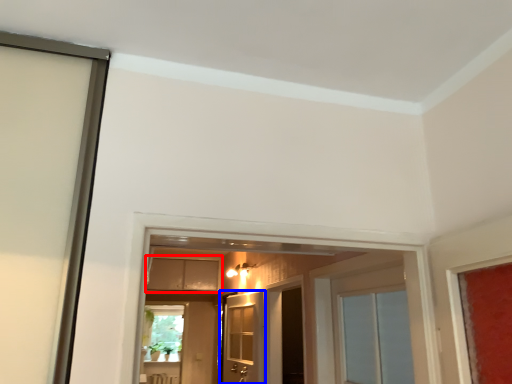
Question: Which of the following is the closest to the observer, cabinetry (highlighted by a red box) or door (highlighted by a blue box)?

Choices:
 (A) cabinetry
 (B) door

Answer: (B)